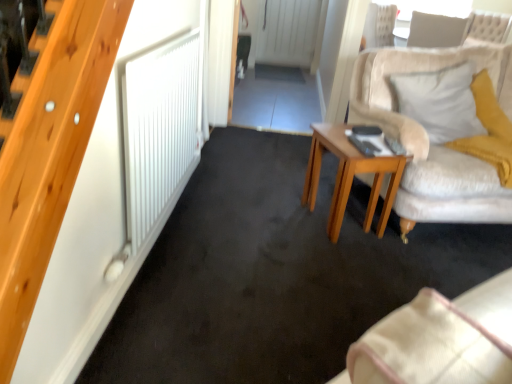
Question: Is wooden side table at center outside of white fabric pillow at upper right, the first pillow from the left?

Choices:
 (A) yes
 (B) no

Answer: (A)

Question: Is wooden side table at center further to the viewer compared to white fabric pillow at upper right, the first pillow from the left?

Choices:
 (A) yes
 (B) no

Answer: (B)

Question: From the image's perspective, is wooden side table at center on white fabric pillow at upper right, the first pillow from the left?

Choices:
 (A) yes
 (B) no

Answer: (B)

Question: Is white fabric pillow at upper right, the first pillow from the left, at the back of wooden side table at center?

Choices:
 (A) no
 (B) yes

Answer: (A)

Question: Are wooden side table at center and white fabric pillow at upper right, acting as the first pillow starting from the front, beside each other?

Choices:
 (A) yes
 (B) no

Answer: (B)

Question: Does wooden side table at center lie in front of white fabric pillow at upper right, which is the 1th pillow in bottom-to-top order?

Choices:
 (A) yes
 (B) no

Answer: (A)

Question: Considering the relative sizes of white fabric pillow at upper right, which is the second pillow in front-to-back order, and wooden side table at center in the image provided, is white fabric pillow at upper right, which is the second pillow in front-to-back order, shorter than wooden side table at center?

Choices:
 (A) no
 (B) yes

Answer: (B)

Question: Can you confirm if white fabric pillow at upper right, marked as the 1th pillow in a top-to-bottom arrangement, is thinner than wooden side table at center?

Choices:
 (A) no
 (B) yes

Answer: (A)

Question: Does white fabric pillow at upper right, the first pillow when ordered from right to left, have a greater height compared to wooden side table at center?

Choices:
 (A) yes
 (B) no

Answer: (B)

Question: Considering the relative positions of white fabric pillow at upper right, acting as the 2th pillow starting from the bottom, and wooden side table at center in the image provided, is white fabric pillow at upper right, acting as the 2th pillow starting from the bottom, in front of wooden side table at center?

Choices:
 (A) no
 (B) yes

Answer: (A)

Question: Is white fabric pillow at upper right, marked as the 2th pillow in a left-to-right arrangement, turned away from wooden side table at center?

Choices:
 (A) yes
 (B) no

Answer: (A)

Question: Is white fabric pillow at upper right, marked as the 2th pillow in a left-to-right arrangement, wider than wooden side table at center?

Choices:
 (A) no
 (B) yes

Answer: (B)

Question: Does white fabric pillow at upper right, acting as the 2th pillow starting from the bottom, have a greater height compared to white fabric pillow at upper right, placed as the 2th pillow when sorted from right to left?

Choices:
 (A) yes
 (B) no

Answer: (B)